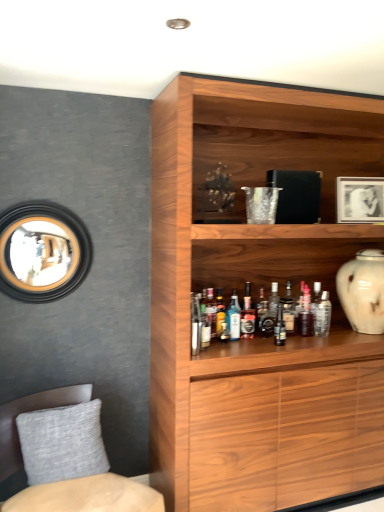
Question: Is translucent glass bottle at shelf center, positioned as the sixth bottle in right-to-left order, completely or partially outside of translucent glass bottle at shelf center, arranged as the 4th bottle when viewed from the right?

Choices:
 (A) yes
 (B) no

Answer: (A)

Question: Can you confirm if translucent glass bottle at shelf center, placed as the fourth bottle when sorted from left to right, is taller than translucent glass bottle at shelf center, arranged as the 6th bottle when viewed from the left?

Choices:
 (A) yes
 (B) no

Answer: (A)

Question: Can you confirm if translucent glass bottle at shelf center, positioned as the sixth bottle in right-to-left order, is positioned to the right of translucent glass bottle at shelf center, arranged as the 6th bottle when viewed from the left?

Choices:
 (A) yes
 (B) no

Answer: (B)

Question: Is translucent glass bottle at shelf center, positioned as the sixth bottle in right-to-left order, oriented towards translucent glass bottle at shelf center, arranged as the 6th bottle when viewed from the left?

Choices:
 (A) yes
 (B) no

Answer: (A)

Question: From the image's perspective, is translucent glass bottle at shelf center, positioned as the sixth bottle in right-to-left order, on top of translucent glass bottle at shelf center, arranged as the 6th bottle when viewed from the left?

Choices:
 (A) no
 (B) yes

Answer: (B)

Question: Is translucent glass bottle at shelf center, positioned as the sixth bottle in right-to-left order, wider than translucent glass bottle at shelf center, arranged as the 6th bottle when viewed from the left?

Choices:
 (A) no
 (B) yes

Answer: (B)

Question: Is translucent glass bottle at shelf center, placed as the fourth bottle when sorted from left to right, at the left side of white glossy picture frame at upper right?

Choices:
 (A) yes
 (B) no

Answer: (A)

Question: Is white glossy picture frame at upper right surrounded by translucent glass bottle at shelf center, placed as the fourth bottle when sorted from left to right?

Choices:
 (A) yes
 (B) no

Answer: (B)

Question: Is translucent glass bottle at shelf center, positioned as the sixth bottle in right-to-left order, not near white glossy picture frame at upper right?

Choices:
 (A) yes
 (B) no

Answer: (B)

Question: Can you confirm if translucent glass bottle at shelf center, placed as the fourth bottle when sorted from left to right, is taller than white glossy picture frame at upper right?

Choices:
 (A) no
 (B) yes

Answer: (A)

Question: Does translucent glass bottle at shelf center, positioned as the sixth bottle in right-to-left order, have a greater width compared to white glossy picture frame at upper right?

Choices:
 (A) yes
 (B) no

Answer: (B)

Question: Can you confirm if translucent glass bottle at shelf center, placed as the fourth bottle when sorted from left to right, is positioned to the right of white glossy picture frame at upper right?

Choices:
 (A) yes
 (B) no

Answer: (B)

Question: Considering the relative sizes of textured gray cushion at lower left and clear glass bottle at shelf center, which is counted as the 9th bottle, starting from the left, in the image provided, is textured gray cushion at lower left smaller than clear glass bottle at shelf center, which is counted as the 9th bottle, starting from the left,?

Choices:
 (A) no
 (B) yes

Answer: (A)